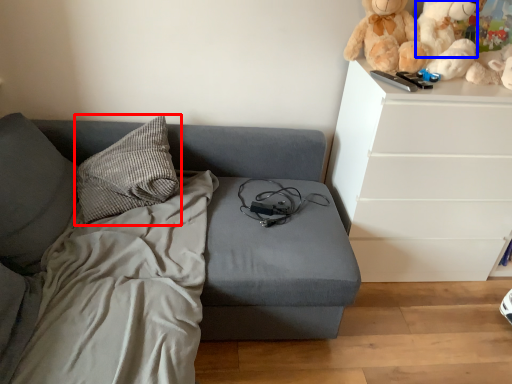
Question: Which of the following is the closest to the observer, pillow (highlighted by a red box) or teddy (highlighted by a blue box)?

Choices:
 (A) pillow
 (B) teddy

Answer: (A)